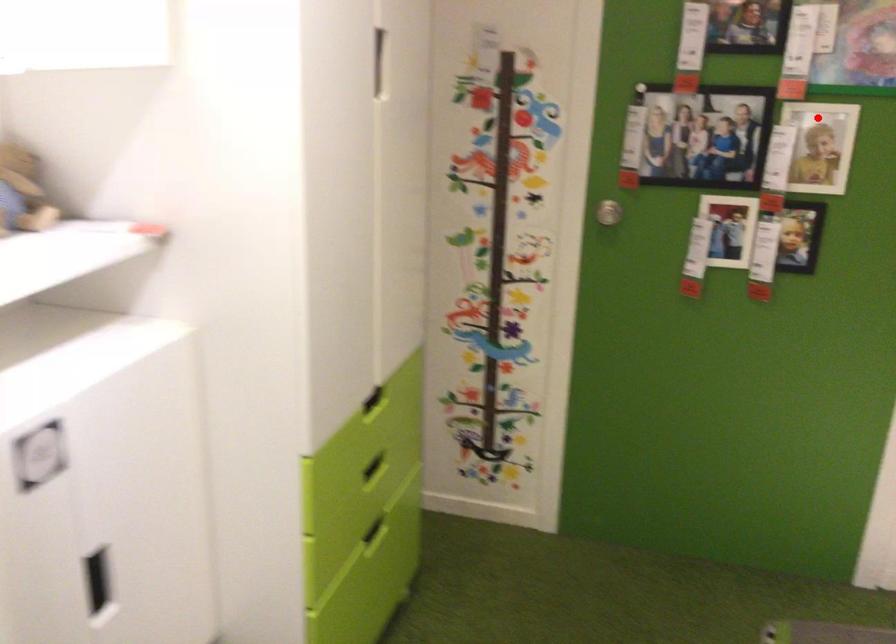
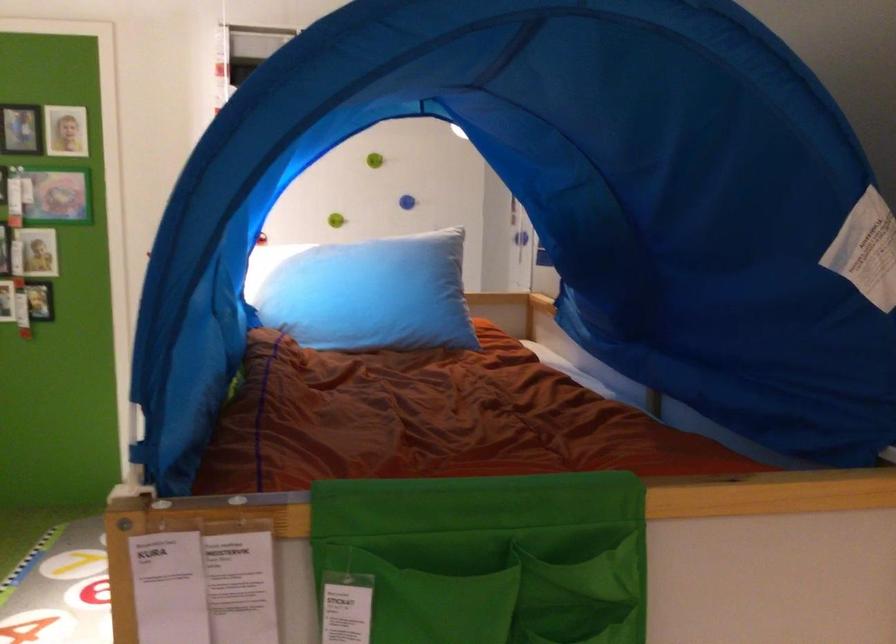
Question: I am providing you with two images of the same scene from different viewpoints. A red point is shown in image1. For the corresponding object point in image2, is it positioned nearer or farther from the camera?

Choices:
 (A) Nearer
 (B) Farther

Answer: (B)